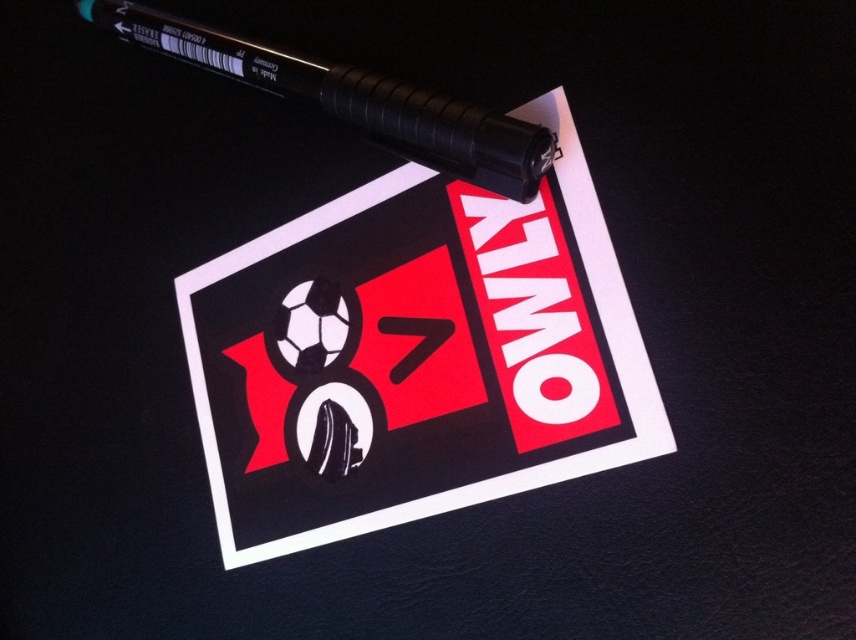
Is white paper at upper center to the left of black rubber pen at upper left from the viewer's perspective?

No, white paper at upper center is not to the left of black rubber pen at upper left.

Between white paper at upper center and black rubber pen at upper left, which one has more height?

Standing taller between the two is white paper at upper center.

Is point (242, 417) positioned after point (455, 109)?

Yes, it is.

Where is `white paper at upper center`? white paper at upper center is located at coordinates (415, 355).